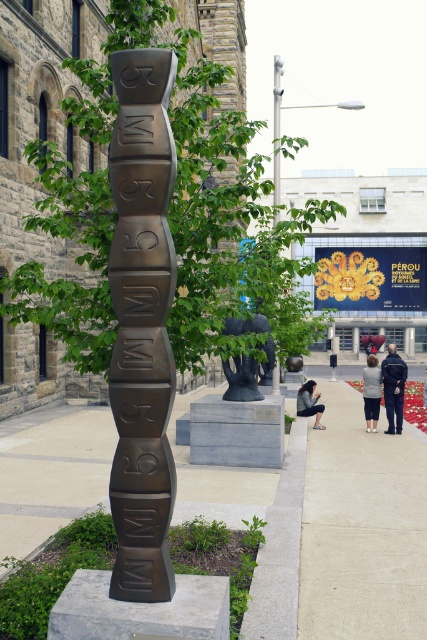
Question: Estimate the real-world distances between objects in this image. Which object is closer to the black matte sculpture at center?

Choices:
 (A) denim jacket at lower right
 (B) dark blue uniform at center
 (C) dark gray sweater at center
 (D) green leafy tree at center

Answer: (C)

Question: Is green leafy tree at center positioned at the back of black matte sculpture at center?

Choices:
 (A) yes
 (B) no

Answer: (B)

Question: Which object is farther from the camera taking this photo?

Choices:
 (A) denim jacket at lower right
 (B) dark blue uniform at center
 (C) bronze textured totem pole at center

Answer: (A)

Question: Is green leafy tree at center in front of bronze textured totem pole at center?

Choices:
 (A) yes
 (B) no

Answer: (B)

Question: Can you confirm if bronze textured totem pole at center is positioned above denim jacket at lower right?

Choices:
 (A) no
 (B) yes

Answer: (B)

Question: Which point is farther to the camera?

Choices:
 (A) (225, 372)
 (B) (152, 582)
 (C) (81, 260)

Answer: (A)